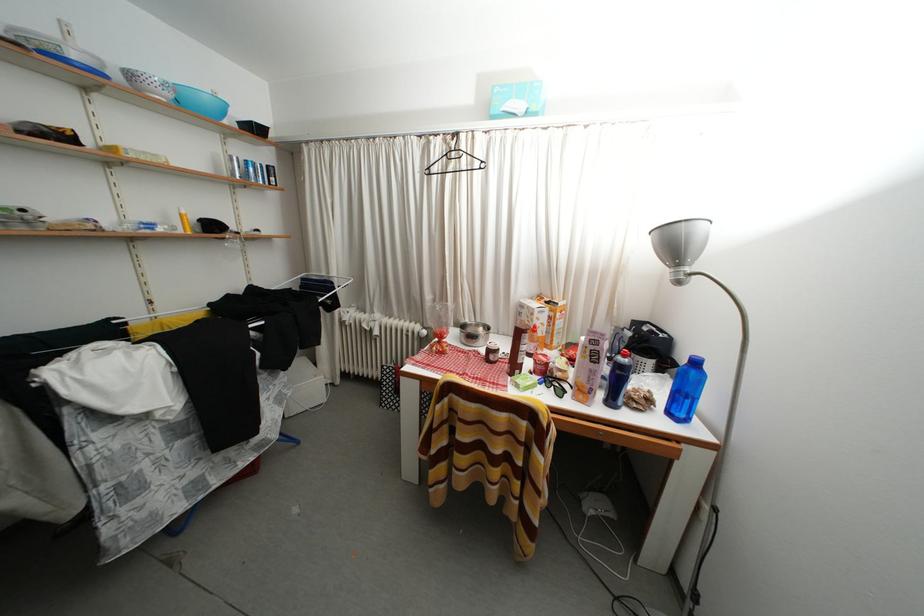
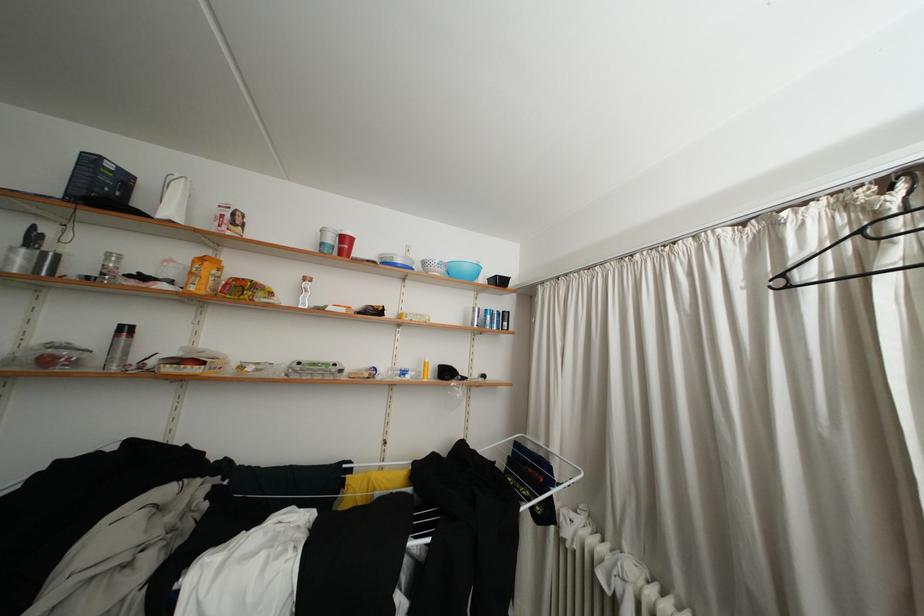
First-person continuous shooting, in which direction is the camera rotating?

The rotation direction of the camera is left-up.